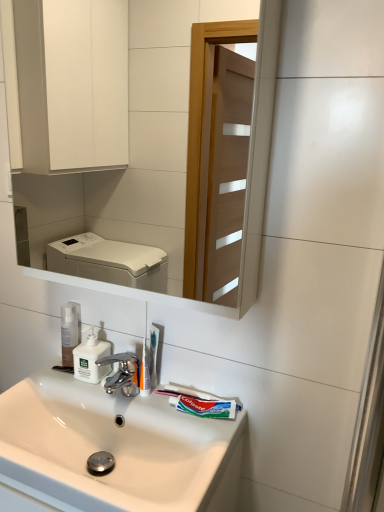
The height and width of the screenshot is (512, 384). What are the coordinates of `free space to the left of white plastic toothbrush at center, which appears as the 2th toothbrush when viewed from the back` in the screenshot? It's located at (97, 389).